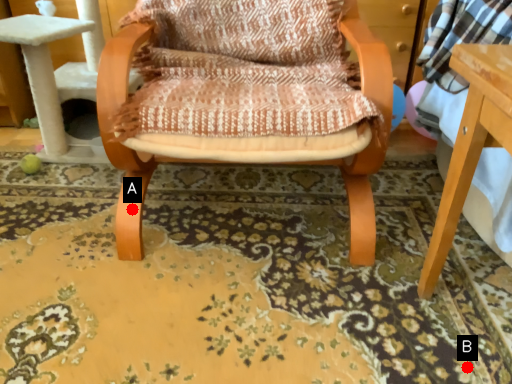
Question: Two points are circled on the image, labeled by A and B beside each circle. Which point is farther from the camera taking this photo?

Choices:
 (A) A is further
 (B) B is further

Answer: (A)